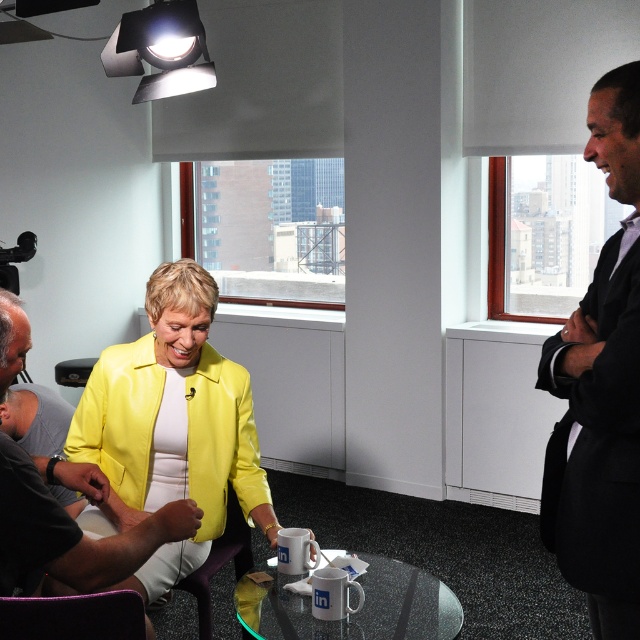
Looking at this image, can you confirm if matte black shirt at lower left is bigger than clear glass table at center?

Correct, matte black shirt at lower left is larger in size than clear glass table at center.

Is the position of matte black shirt at lower left more distant than that of clear glass table at center?

No, it is not.

Identify the location of matte black shirt at lower left. This screenshot has width=640, height=640. (72, 525).

Between yellow leather jacket at center and clear glass table at center, which one has less height?

clear glass table at center is shorter.

Is yellow leather jacket at center above clear glass table at center?

Yes, yellow leather jacket at center is above clear glass table at center.

Between point (157, 294) and point (438, 588), which one is positioned in front?

Positioned in front is point (157, 294).

Image resolution: width=640 pixels, height=640 pixels. Identify the location of yellow leather jacket at center. coord(172,428).

Between black suit at right and clear glass table at center, which one appears on the left side from the viewer's perspective?

From the viewer's perspective, clear glass table at center appears more on the left side.

Between black suit at right and clear glass table at center, which one has less height?

With less height is clear glass table at center.

What are the coordinates of `black suit at right` in the screenshot? It's located at [x=600, y=388].